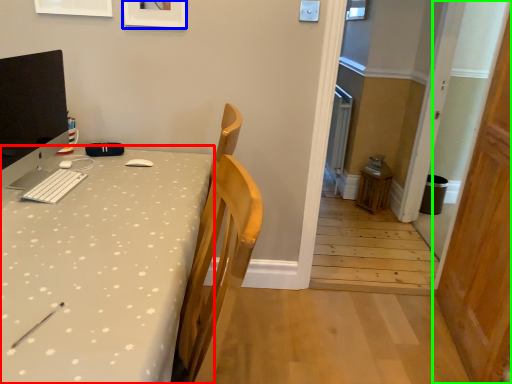
Question: Based on their relative distances, which object is nearer to desk (highlighted by a red box)? Choose from picture frame (highlighted by a blue box) and door (highlighted by a green box).

Choices:
 (A) picture frame
 (B) door

Answer: (A)